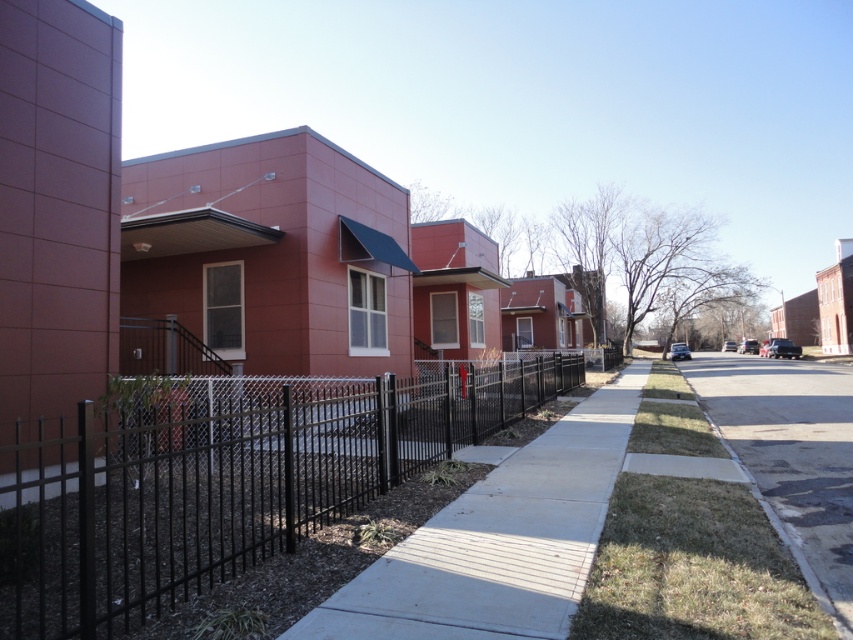
Question: Which point is farther to the camera?

Choices:
 (A) (532, 456)
 (B) (749, 477)
 (C) (112, 616)

Answer: (A)

Question: Where is smooth concrete sidewalk at center located in relation to asphalt pavement at lower right in the image?

Choices:
 (A) left
 (B) right

Answer: (A)

Question: Among these objects, which one is nearest to the camera?

Choices:
 (A) asphalt pavement at lower right
 (B) smooth concrete sidewalk at center
 (C) black metal fence at center

Answer: (C)

Question: From the image, what is the correct spatial relationship of black metal fence at center in relation to smooth concrete sidewalk at center?

Choices:
 (A) left
 (B) right

Answer: (A)

Question: Among these points, which one is farthest from the camera?

Choices:
 (A) (787, 472)
 (B) (253, 397)
 (C) (537, 573)

Answer: (B)

Question: Is black metal fence at center to the right of asphalt pavement at lower right from the viewer's perspective?

Choices:
 (A) no
 (B) yes

Answer: (A)